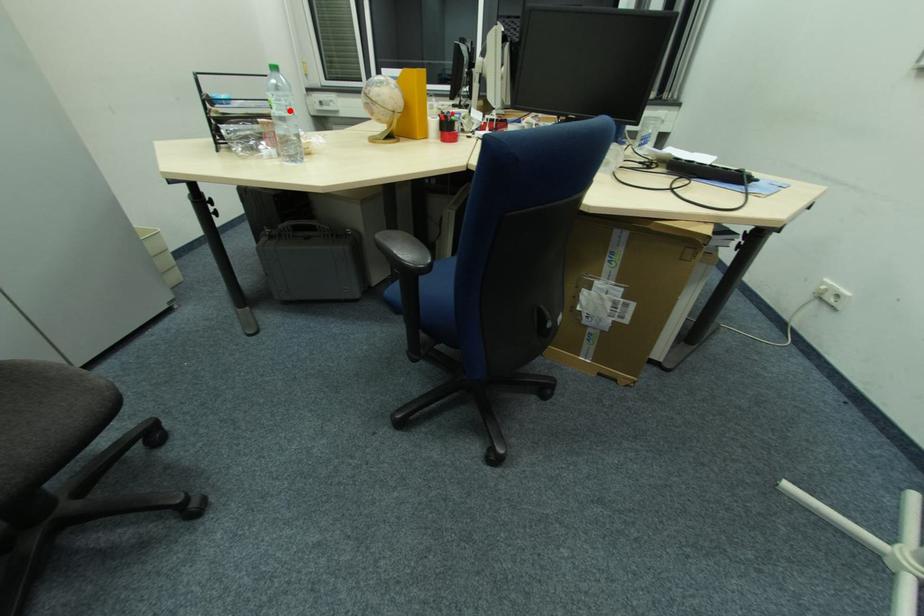
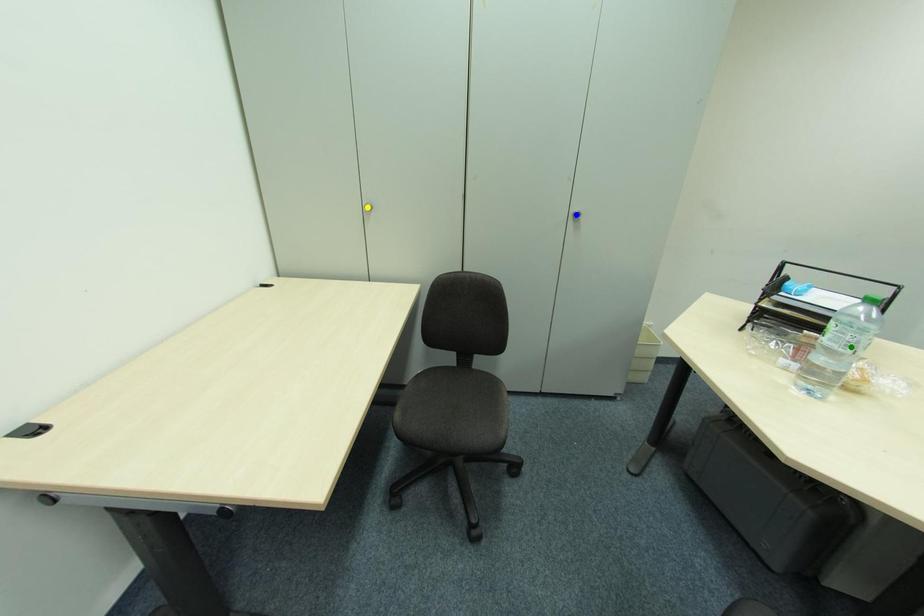
Question: I am providing you with two images of the same scene from different viewpoints. A red point is marked on the first image. You are given multiple points on the second image. Which mark in image 2 goes with the point in image 1?

Choices:
 (A) blue point
 (B) green point
 (C) yellow point

Answer: (B)